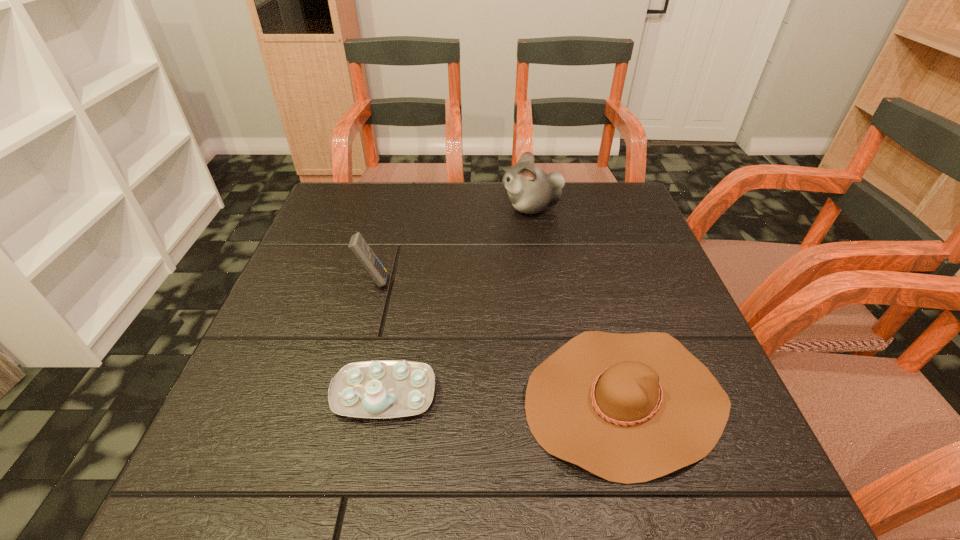
Image resolution: width=960 pixels, height=540 pixels. In order to click on vacant position in the image that satisfies the following two spatial constraints: 1. on the front side of the shortest object; 2. on the right side of the chinaware in this screenshot , I will do `click(383, 399)`.

The width and height of the screenshot is (960, 540). What are the coordinates of `free spot that satisfies the following two spatial constraints: 1. on the front-facing side of the calculator; 2. on the right side of the chinaware` in the screenshot? It's located at (344, 394).

The height and width of the screenshot is (540, 960). I want to click on free space that satisfies the following two spatial constraints: 1. on the front-facing side of the second tallest object; 2. on the left side of the cowboy hat, so click(x=342, y=399).

Where is `free location that satisfies the following two spatial constraints: 1. on the front-facing side of the shortest object; 2. on the left side of the second tallest object`? The height and width of the screenshot is (540, 960). free location that satisfies the following two spatial constraints: 1. on the front-facing side of the shortest object; 2. on the left side of the second tallest object is located at coordinates (342, 399).